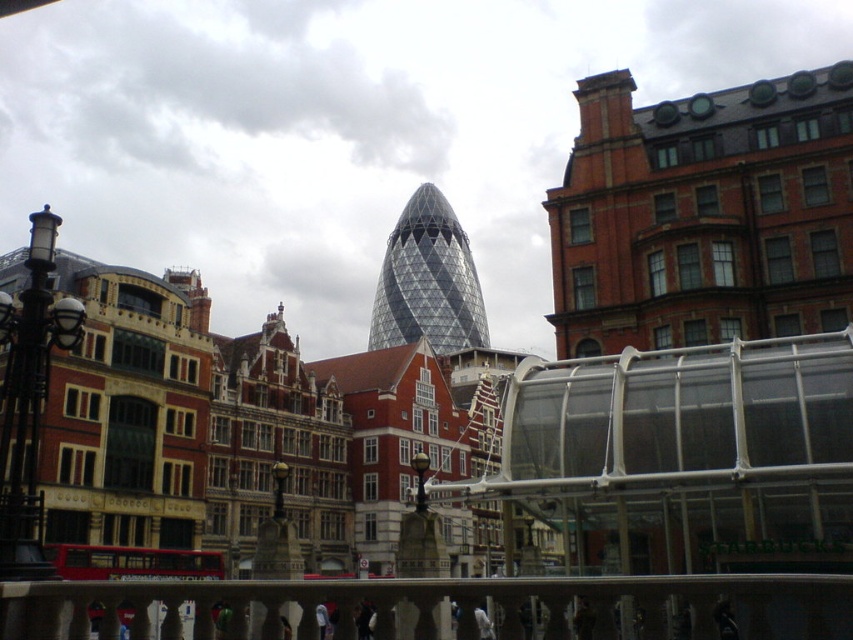
Question: Is white marble railing at center smaller than transparent glass tower at center?

Choices:
 (A) no
 (B) yes

Answer: (B)

Question: Does white marble railing at center lie in front of transparent glass tower at center?

Choices:
 (A) yes
 (B) no

Answer: (A)

Question: Does white marble railing at center appear over transparent glass tower at center?

Choices:
 (A) yes
 (B) no

Answer: (B)

Question: Which of the following is the closest to the observer?

Choices:
 (A) (479, 333)
 (B) (665, 636)

Answer: (B)

Question: Among these objects, which one is nearest to the camera?

Choices:
 (A) white marble railing at center
 (B) transparent glass tower at center

Answer: (A)